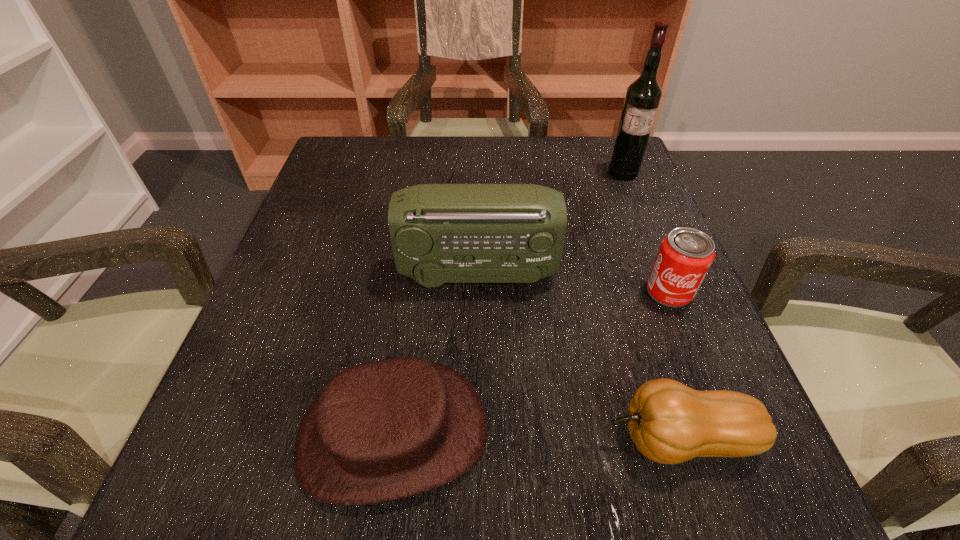
This screenshot has height=540, width=960. I want to click on vacant space that is in between the gourd and the radio_receiver, so click(x=578, y=356).

Locate an element on the screen. free spot between the gourd and the hat is located at coordinates (537, 436).

Where is `empty space between the hat and the can`? The width and height of the screenshot is (960, 540). empty space between the hat and the can is located at coordinates (531, 362).

At what (x,y) coordinates should I click in order to perform the action: click on free area in between the tallest object and the hat. Please return your answer as a coordinate pair (x, y). The height and width of the screenshot is (540, 960). Looking at the image, I should click on (508, 303).

Identify the location of free spot between the tallest object and the gourd. This screenshot has width=960, height=540. (651, 306).

Locate an element on the screen. The image size is (960, 540). free spot between the gourd and the can is located at coordinates (675, 365).

Locate an element on the screen. free point between the radio_receiver and the hat is located at coordinates (435, 353).

The width and height of the screenshot is (960, 540). Identify the location of object identified as the second closest to the can. (670, 423).

This screenshot has width=960, height=540. Find the location of `object that can be found as the second closest to the gourd`. object that can be found as the second closest to the gourd is located at coordinates (685, 255).

Locate an element on the screen. This screenshot has height=540, width=960. vacant position in the image that satisfies the following two spatial constraints: 1. on the front-facing side of the can; 2. on the left side of the radio_receiver is located at coordinates (477, 292).